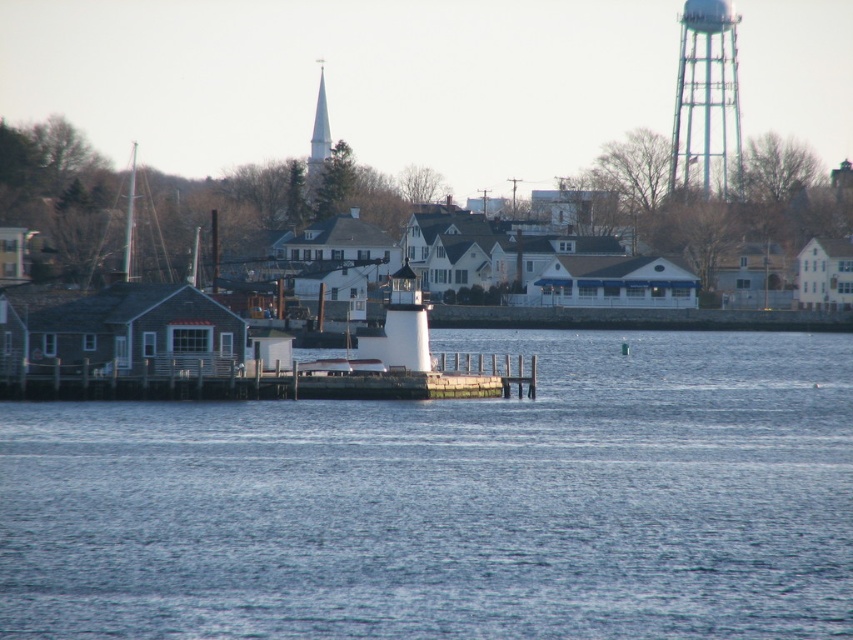
Question: Which is nearer to the white matte water tower at center?

Choices:
 (A) white wooden dock at center
 (B) white steeple at upper center
 (C) blue water at center
 (D) metallic lattice tower at upper right

Answer: (A)

Question: Is white wooden dock at center below white steeple at upper center?

Choices:
 (A) yes
 (B) no

Answer: (A)

Question: Can you confirm if blue water at center is positioned to the left of white wooden dock at center?

Choices:
 (A) no
 (B) yes

Answer: (B)

Question: Which object is the farthest from the white matte water tower at center?

Choices:
 (A) metallic lattice tower at upper right
 (B) white wooden dock at center
 (C) blue water at center
 (D) white steeple at upper center

Answer: (A)

Question: Can you confirm if white matte water tower at center is positioned below white steeple at upper center?

Choices:
 (A) no
 (B) yes

Answer: (B)

Question: Which object is the closest to the white matte water tower at center?

Choices:
 (A) white wooden dock at center
 (B) metallic lattice tower at upper right
 (C) blue water at center

Answer: (A)